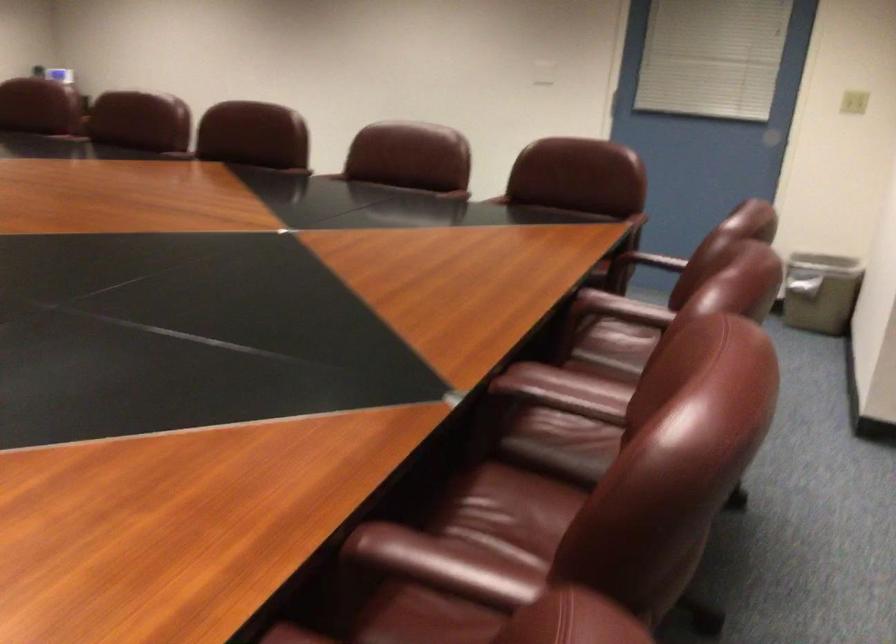
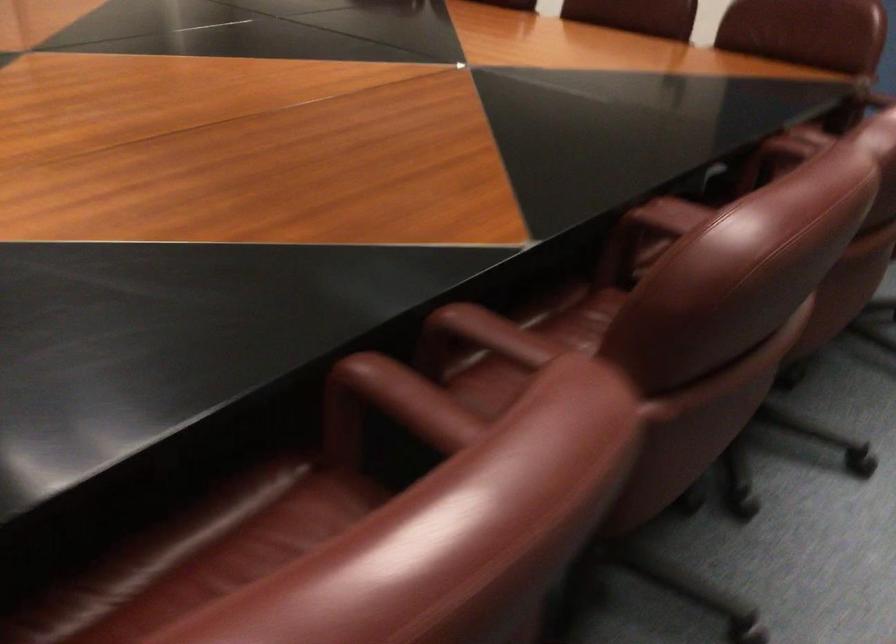
The point at (x=286, y=161) is marked in the first image. Where is the corresponding point in the second image?

(493, 334)